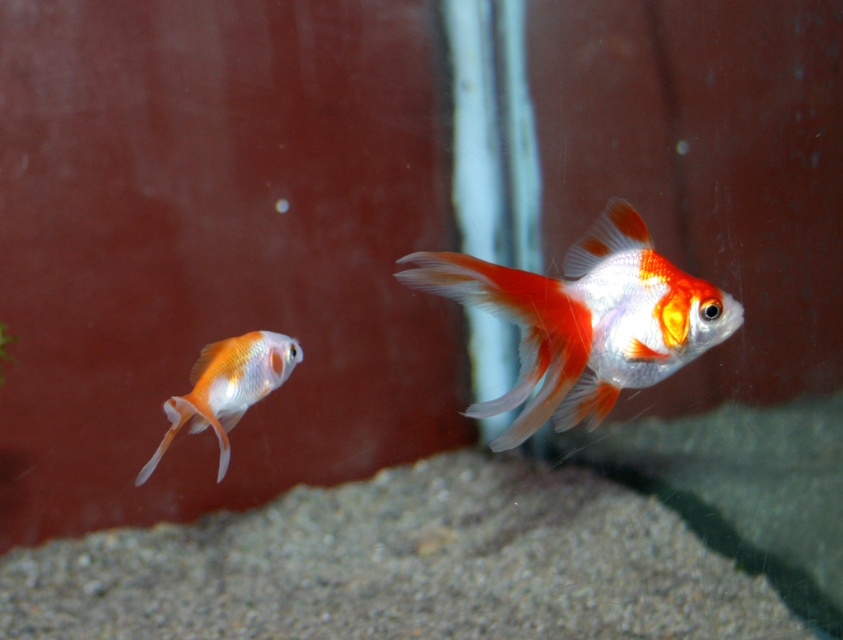
Question: Which of the following is the closest to the observer?

Choices:
 (A) shiny orange and white goldfish at center
 (B) matte orange goldfish at left

Answer: (A)

Question: Is shiny orange and white goldfish at center positioned behind matte orange goldfish at left?

Choices:
 (A) no
 (B) yes

Answer: (A)

Question: Is shiny orange and white goldfish at center to the left of matte orange goldfish at left from the viewer's perspective?

Choices:
 (A) no
 (B) yes

Answer: (A)

Question: Which point is closer to the camera taking this photo?

Choices:
 (A) (245, 365)
 (B) (482, 262)

Answer: (B)

Question: Can you confirm if shiny orange and white goldfish at center is bigger than matte orange goldfish at left?

Choices:
 (A) no
 (B) yes

Answer: (B)